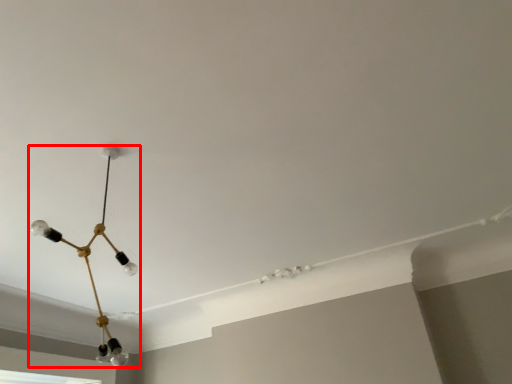
Question: From the image's perspective, considering the relative positions of lamp (annotated by the red box) and window in the image provided, where is lamp (annotated by the red box) located with respect to the staircase?

Choices:
 (A) below
 (B) above

Answer: (B)